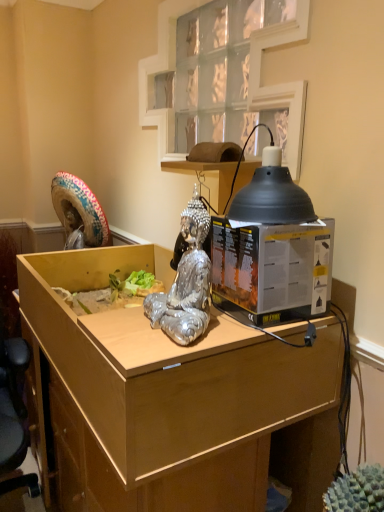
Question: Is matte black desktop computer at center surrounded by black matte lampshade at upper right?

Choices:
 (A) yes
 (B) no

Answer: (B)

Question: Considering the relative positions of black matte lampshade at upper right and matte black desktop computer at center in the image provided, is black matte lampshade at upper right in front of matte black desktop computer at center?

Choices:
 (A) no
 (B) yes

Answer: (B)

Question: Is black matte lampshade at upper right behind matte black desktop computer at center?

Choices:
 (A) no
 (B) yes

Answer: (A)

Question: From a real-world perspective, is black matte lampshade at upper right positioned over matte black desktop computer at center based on gravity?

Choices:
 (A) no
 (B) yes

Answer: (B)

Question: Is black matte lampshade at upper right to the left of matte black desktop computer at center from the viewer's perspective?

Choices:
 (A) yes
 (B) no

Answer: (B)

Question: Is black matte lampshade at upper right far from matte black desktop computer at center?

Choices:
 (A) yes
 (B) no

Answer: (B)

Question: Are matte black desktop computer at center and wooden desk at center far apart?

Choices:
 (A) yes
 (B) no

Answer: (B)

Question: From a real-world perspective, does matte black desktop computer at center stand above wooden desk at center?

Choices:
 (A) yes
 (B) no

Answer: (A)

Question: From a real-world perspective, is matte black desktop computer at center under wooden desk at center?

Choices:
 (A) no
 (B) yes

Answer: (A)

Question: Considering the relative sizes of matte black desktop computer at center and wooden desk at center in the image provided, is matte black desktop computer at center shorter than wooden desk at center?

Choices:
 (A) yes
 (B) no

Answer: (A)

Question: Is matte black desktop computer at center facing away from wooden desk at center?

Choices:
 (A) yes
 (B) no

Answer: (B)

Question: Can you confirm if matte black desktop computer at center is smaller than wooden desk at center?

Choices:
 (A) no
 (B) yes

Answer: (B)

Question: Are black matte lampshade at upper right and shiny silver statue at center beside each other?

Choices:
 (A) yes
 (B) no

Answer: (B)